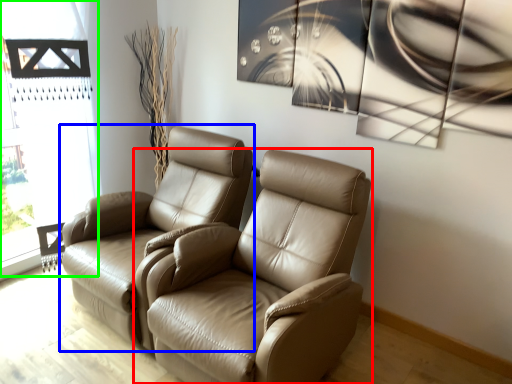
Question: Considering the real-world distances, which object is closest to chair (highlighted by a red box)? chair (highlighted by a blue box) or window frame (highlighted by a green box).

Choices:
 (A) chair
 (B) window frame

Answer: (A)